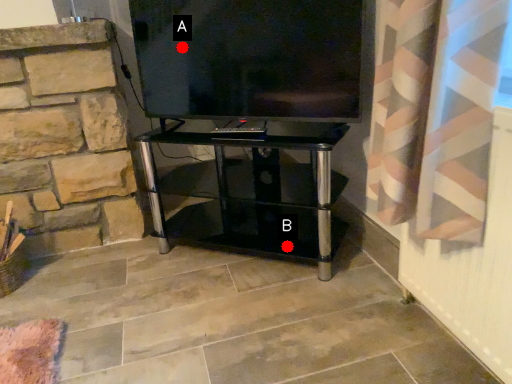
Question: Two points are circled on the image, labeled by A and B beside each circle. Which point is closer to the camera?

Choices:
 (A) A is closer
 (B) B is closer

Answer: (A)